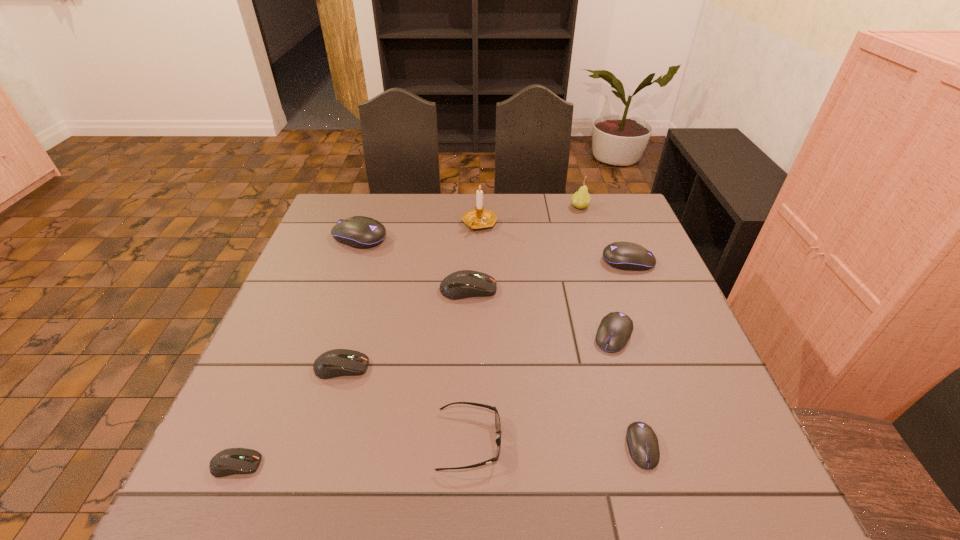
The width and height of the screenshot is (960, 540). Identify the location of computer mouse that is at the far edge. (360, 232).

Find the location of a particular element. sunglasses at the near edge is located at coordinates (497, 419).

Where is `pear at the right edge`? The width and height of the screenshot is (960, 540). pear at the right edge is located at coordinates (581, 199).

Find the location of a particular element. This screenshot has width=960, height=540. object that is positioned at the far left corner is located at coordinates point(360,232).

Locate an element on the screen. object located at the near left corner is located at coordinates coord(230,461).

Image resolution: width=960 pixels, height=540 pixels. Find the location of `object at the far right corner`. object at the far right corner is located at coordinates tap(581, 199).

I want to click on vacant space at the far edge of the desktop, so click(533, 235).

In the image, there is a desktop. At what (x,y) coordinates should I click in order to perform the action: click on vacant region at the near edge. Please return your answer as a coordinate pair (x, y). The height and width of the screenshot is (540, 960). Looking at the image, I should click on (356, 464).

Locate an element on the screen. This screenshot has width=960, height=540. vacant space at the right edge is located at coordinates [x=648, y=357].

Identify the location of vacant space at the far left corner of the desktop. (372, 212).